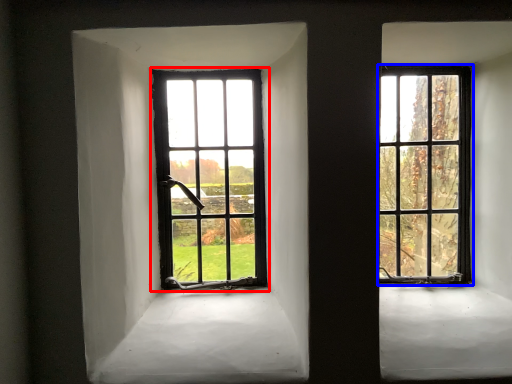
Question: Which object appears farthest to the camera in this image, window (highlighted by a red box) or window (highlighted by a blue box)?

Choices:
 (A) window
 (B) window

Answer: (A)